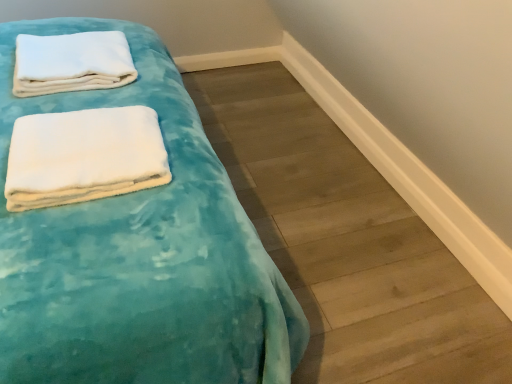
Question: Would you say white soft towel at upper left, placed as the 2th towel when sorted from front to back, is to the left or to the right of teal velvety bed at left in the picture?

Choices:
 (A) right
 (B) left

Answer: (B)

Question: From a real-world perspective, relative to teal velvety bed at left, is white soft towel at upper left, the 2th towel when ordered from bottom to top, vertically above or below?

Choices:
 (A) above
 (B) below

Answer: (B)

Question: Estimate the real-world distances between objects in this image. Which object is farther from the white soft towel at upper left, placed as the 2th towel when sorted from front to back?

Choices:
 (A) teal velvety blanket at upper left
 (B) white soft towel at upper left, the second towel when ordered from back to front
 (C) teal velvety bed at left

Answer: (A)

Question: Estimate the real-world distances between objects in this image. Which object is farther from the white soft towel at upper left, the second towel when ordered from back to front?

Choices:
 (A) teal velvety bed at left
 (B) teal velvety blanket at upper left
 (C) white soft towel at upper left, placed as the 2th towel when sorted from front to back

Answer: (B)